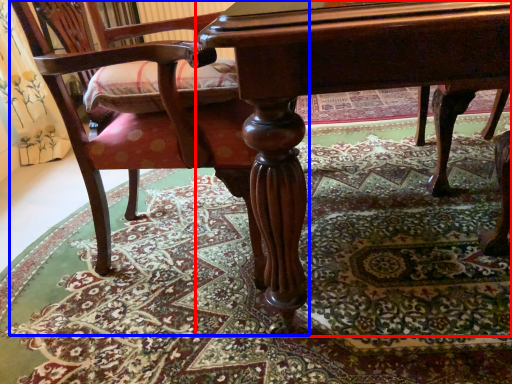
Question: Which object is further to the camera taking this photo, table (highlighted by a red box) or chair (highlighted by a blue box)?

Choices:
 (A) table
 (B) chair

Answer: (B)